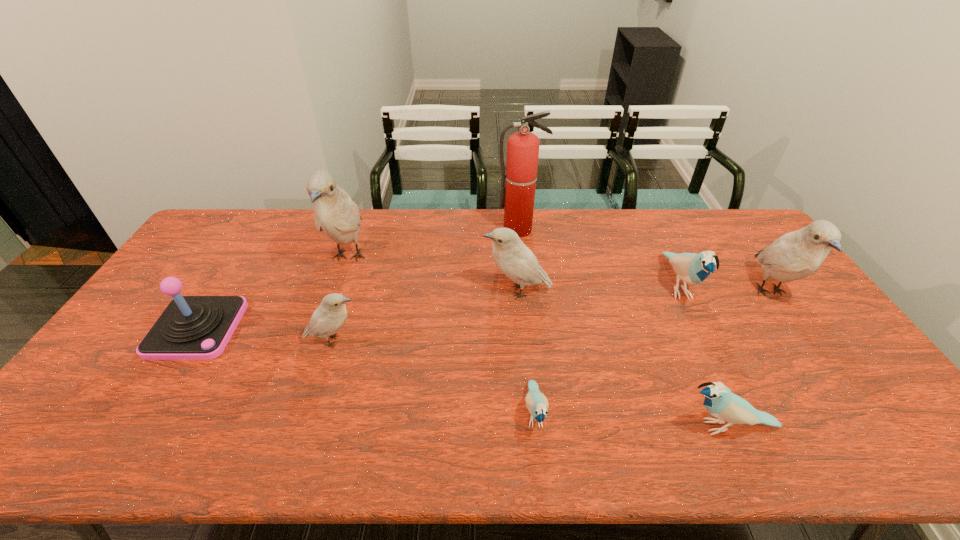
Where is `vacant area located 0.120m at the beak of the second smallest white bird`? The image size is (960, 540). vacant area located 0.120m at the beak of the second smallest white bird is located at coordinates (444, 292).

The image size is (960, 540). Find the location of `free location located 0.230m at the face of the farthest blue bird`. free location located 0.230m at the face of the farthest blue bird is located at coordinates (727, 389).

You are a GUI agent. You are given a task and a screenshot of the screen. Output one action in this format:
    pyautogui.click(x=<x>, y=<y>)
    Task: Click on the free space located forward from the base of the pink joystick
    The image size is (960, 540).
    Given the screenshot: What is the action you would take?
    pyautogui.click(x=155, y=396)

Locate an element on the screen. free space located at the beak of the nearest white bird is located at coordinates (443, 341).

Locate an element on the screen. vacant position located at the face of the second biggest blue bird is located at coordinates (531, 427).

Find the location of a particular element. The height and width of the screenshot is (540, 960). free space located 0.190m at the face of the second biggest blue bird is located at coordinates (595, 427).

Locate an element on the screen. vacant space located 0.200m at the face of the second biggest blue bird is located at coordinates point(590,427).

You are a GUI agent. You are given a task and a screenshot of the screen. Output one action in this format:
    pyautogui.click(x=<x>, y=<y>)
    Task: Click on the fire extinguisher located in the far edge section of the desktop
    
    Given the screenshot: What is the action you would take?
    pyautogui.click(x=518, y=192)

Find the location of a particular element. bird located in the far edge section of the desktop is located at coordinates (335, 214).

This screenshot has width=960, height=540. Identify the location of object that is at the left edge. (191, 327).